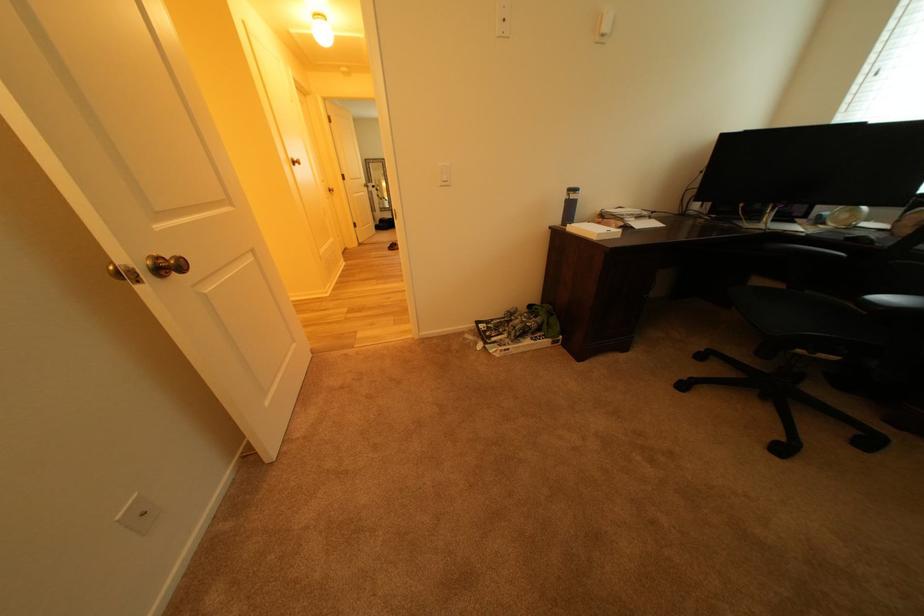
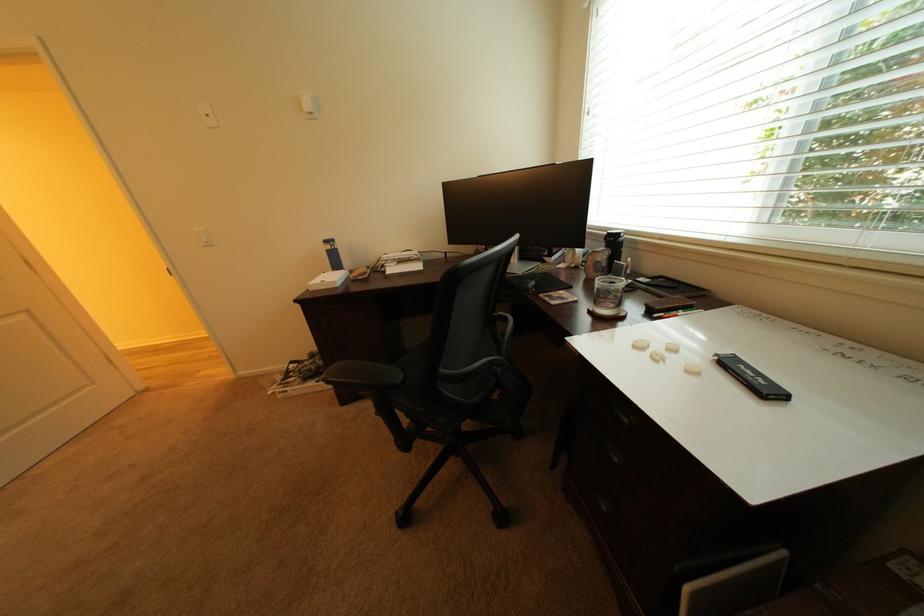
Question: The images are taken continuously from a first-person perspective. In which direction are you moving?

Choices:
 (A) Left
 (B) Right
 (C) Forward
 (D) Backward

Answer: (B)